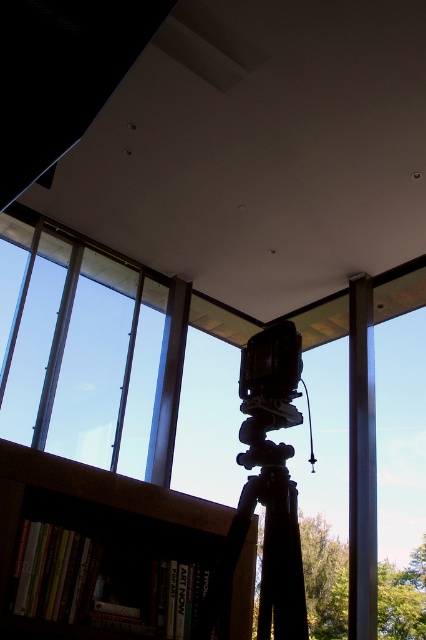
You are setting up equipment in the room. You have a black matte tripod at center and a metallic pole at center. According to the scene, which object is positioned to the left when viewed from the front?

The black matte tripod at center is positioned to the left of the metallic pole at center when viewed from the front.

You are a photographer setting up equipment in the room. You need to move the camera closer to the metallic pole at center so that they are only 10 feet apart. Is this adjustment possible given the space available?

The metallic pole at center and camera are currently 11.81 feet apart. Since 10 feet is less than 11.81 feet, moving the camera closer to reduce the distance to 10 feet is possible within the available space.

You are a photographer standing in the room and want to adjust the camera settings on the black matte tripod at center. Can you reach the tripod without moving your current position?

The black matte tripod at center and viewer are 1.48 meters apart from each other, so you cannot reach the tripod without moving closer since the distance is greater than an average person can reach comfortably.